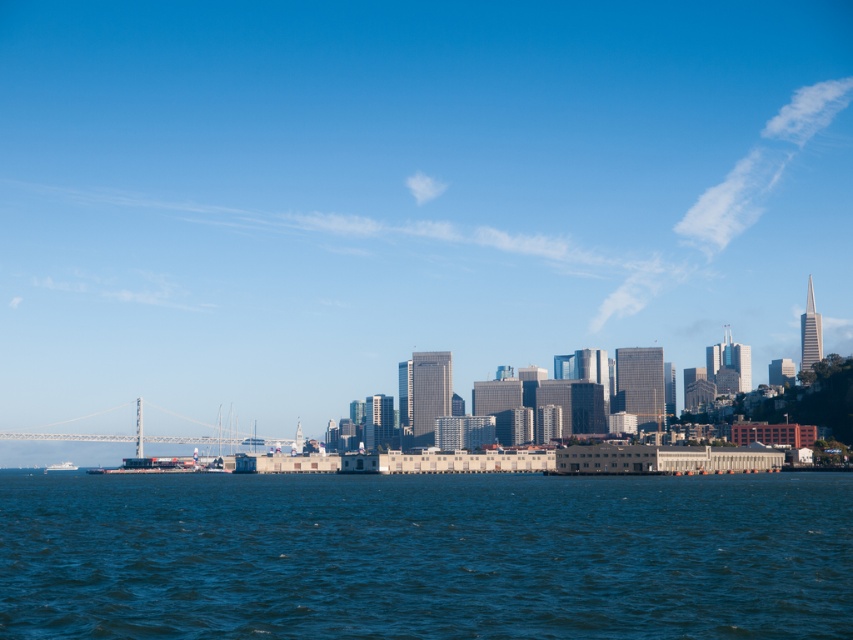
Question: Is metallic gray bridge at left to the left of white glossy boat at lower left from the viewer's perspective?

Choices:
 (A) yes
 (B) no

Answer: (B)

Question: Which object is positioned farthest from the white glossy boat at lower left?

Choices:
 (A) metallic gray bridge at left
 (B) blue water at center
 (C) transparent glass skyscrapers at center

Answer: (B)

Question: In this image, where is blue water at center located relative to metallic gray bridge at left?

Choices:
 (A) left
 (B) right

Answer: (B)

Question: Can you confirm if transparent glass skyscrapers at center is positioned below white glossy boat at lower left?

Choices:
 (A) yes
 (B) no

Answer: (B)

Question: Among these points, which one is nearest to the camera?

Choices:
 (A) (328, 596)
 (B) (144, 440)
 (C) (48, 470)

Answer: (A)

Question: Which point appears closest to the camera in this image?

Choices:
 (A) (508, 22)
 (B) (59, 470)
 (C) (94, 413)

Answer: (A)